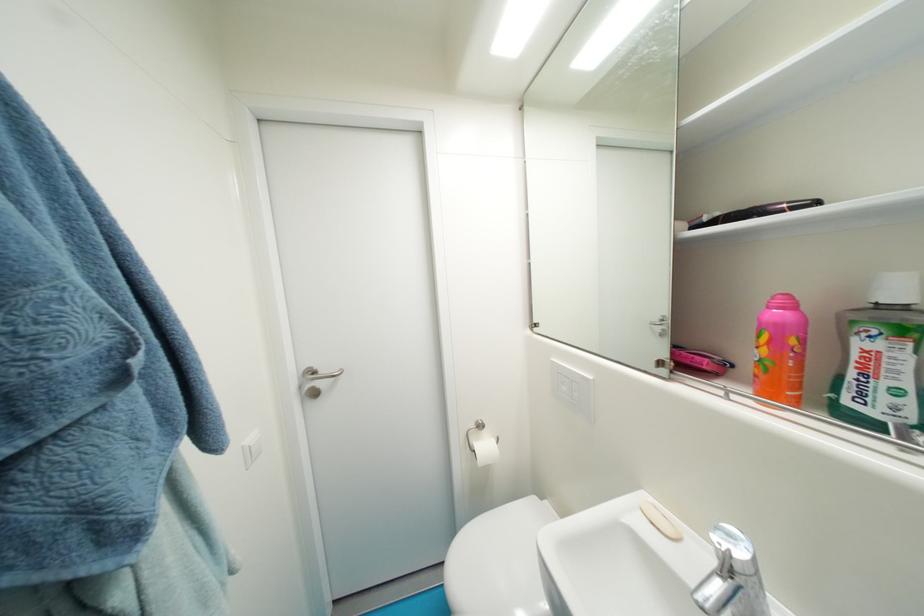
What do you see at coordinates (771, 575) in the screenshot? The width and height of the screenshot is (924, 616). I see `a silver faucet handle` at bounding box center [771, 575].